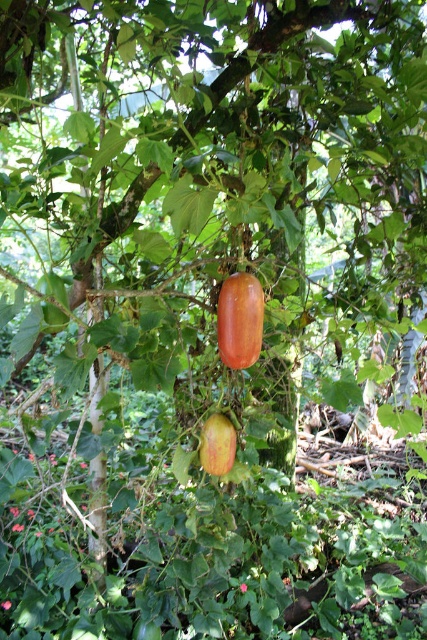
Between shiny orange squash at center and green matte apple at center, which one has more height?

Standing taller between the two is shiny orange squash at center.

Between shiny orange squash at center and green matte apple at center, which one is positioned lower?

green matte apple at center is below.

Which is in front, point (251, 339) or point (225, 422)?

Point (251, 339) is in front.

Locate an element on the screen. This screenshot has height=640, width=427. shiny orange squash at center is located at coordinates (239, 321).